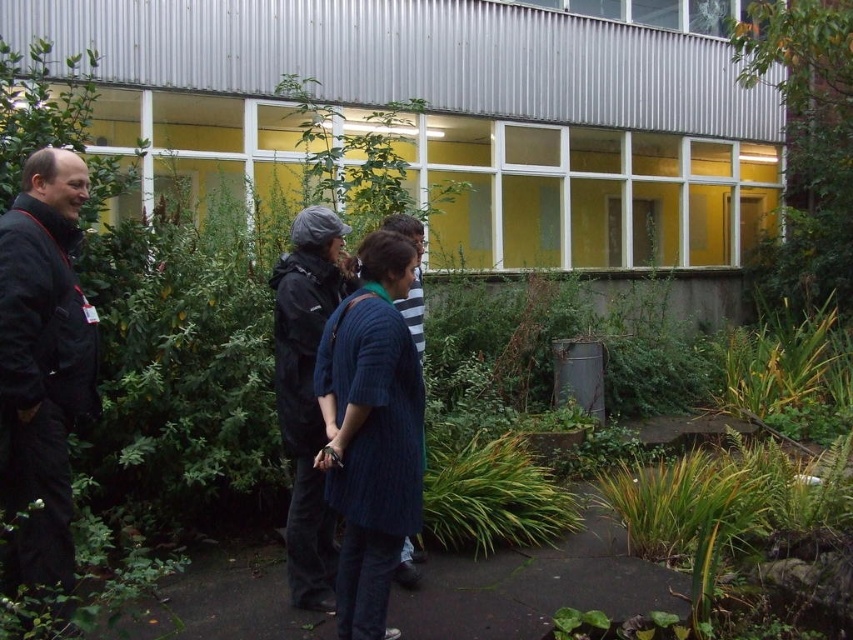
You are a photographer trying to capture a group photo of the black matte jacket at left and the dark gray hooded jacket at center. The camera you are using has a minimum focusing distance of 1 meter. Can you take a clear photo of both jackets without moving them?

The black matte jacket at left is 1.07 meters away from the dark gray hooded jacket at center. Since the minimum focusing distance is 1 meter, the camera can focus on both jackets as the distance between them is slightly more than the required 1 meter.